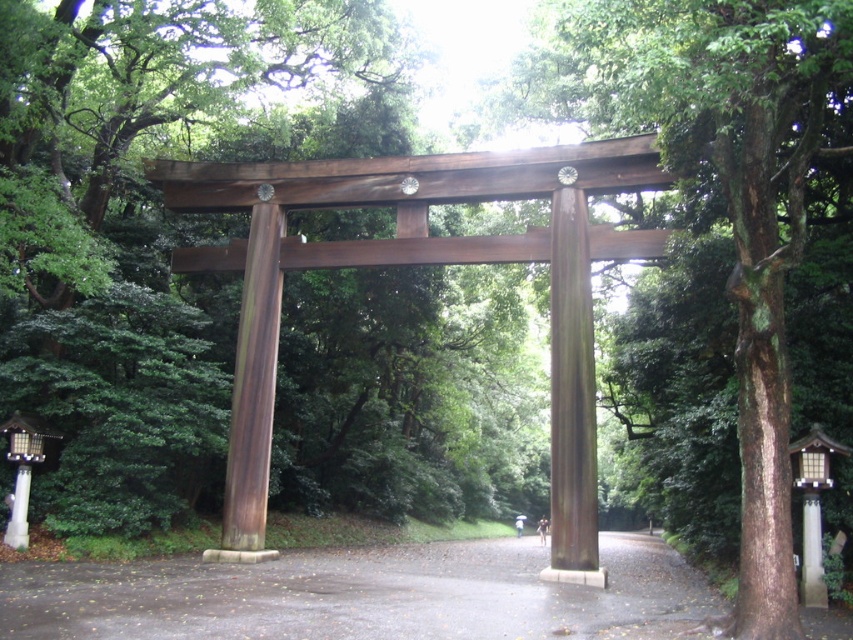
Which is below, green mossy bark tree at center or brown polished wood at center?

brown polished wood at center

Can you confirm if green mossy bark tree at center is positioned to the right of brown polished wood at center?

Indeed, green mossy bark tree at center is positioned on the right side of brown polished wood at center.

Is point (694, 100) positioned behind point (252, 557)?

No, it is not.

At what (x,y) coordinates should I click in order to perform the action: click on green mossy bark tree at center. Please return your answer as a coordinate pair (x, y). The height and width of the screenshot is (640, 853). Looking at the image, I should click on (733, 196).

What are the coordinates of `glossy asphalt path at center` in the screenshot? It's located at (361, 595).

Which is in front, point (387, 592) or point (206, 557)?

Point (387, 592) is in front.

Find the location of a particular element. The image size is (853, 640). glossy asphalt path at center is located at coordinates (361, 595).

Does glossy asphalt path at center have a larger size compared to brown polished wood post at center?

Correct, glossy asphalt path at center is larger in size than brown polished wood post at center.

Between point (270, 579) and point (567, 314), which one is positioned behind?

The point (567, 314) is more distant.

Find the location of a particular element. The height and width of the screenshot is (640, 853). glossy asphalt path at center is located at coordinates (361, 595).